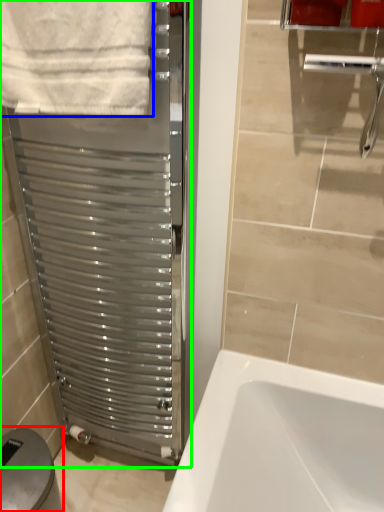
Question: Which object is the closest to the gray (highlighted by a red box)? Choose among these: towel (highlighted by a blue box) or screen door (highlighted by a green box).

Choices:
 (A) towel
 (B) screen door

Answer: (B)